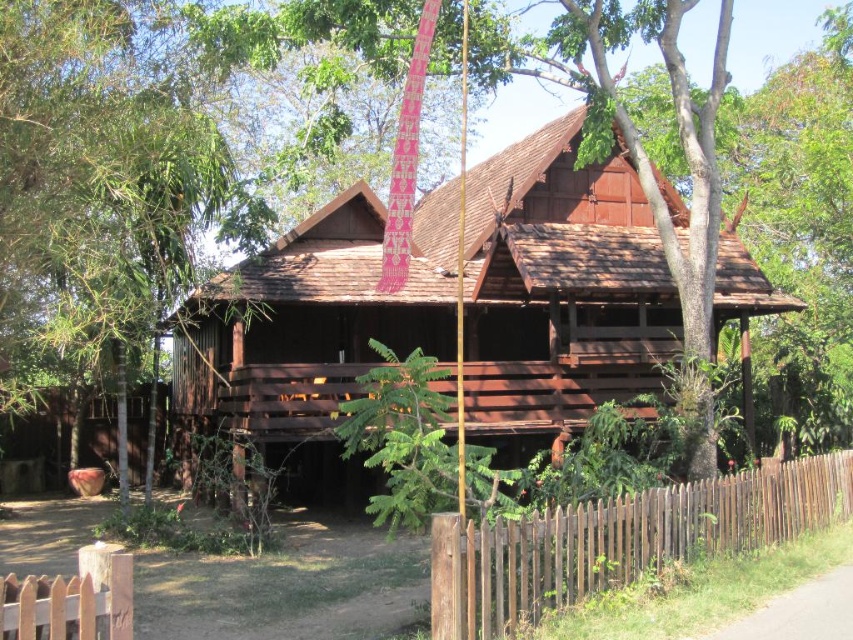
You are standing at the entrance of the traditional wooden house and notice a point marked at coordinates [618,540]. What object is located at that point?

The point at coordinates [618,540] corresponds to the brown wooden fence at lower right.

You are a delivery person with a cart that is 2 meters wide. You need to deliver a package to the brown wooden hut at center. There is a brown wooden fence at lower right nearby. Can you pass through the space between them to reach the hut?

The brown wooden hut at center and brown wooden fence at lower right are 8.40 meters apart from each other. Since your cart is only 2 meters wide, you can easily pass through the space between them to reach the brown wooden hut at center.